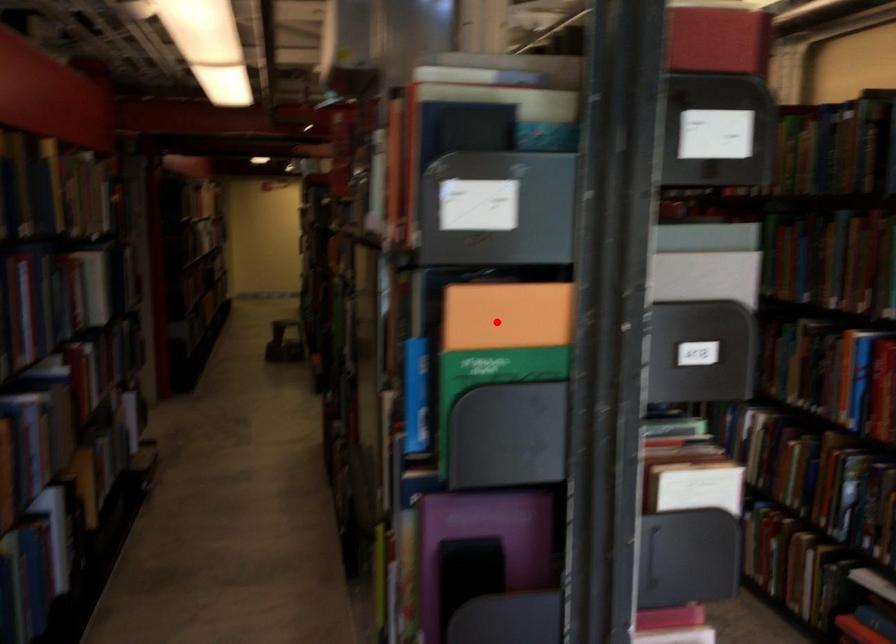
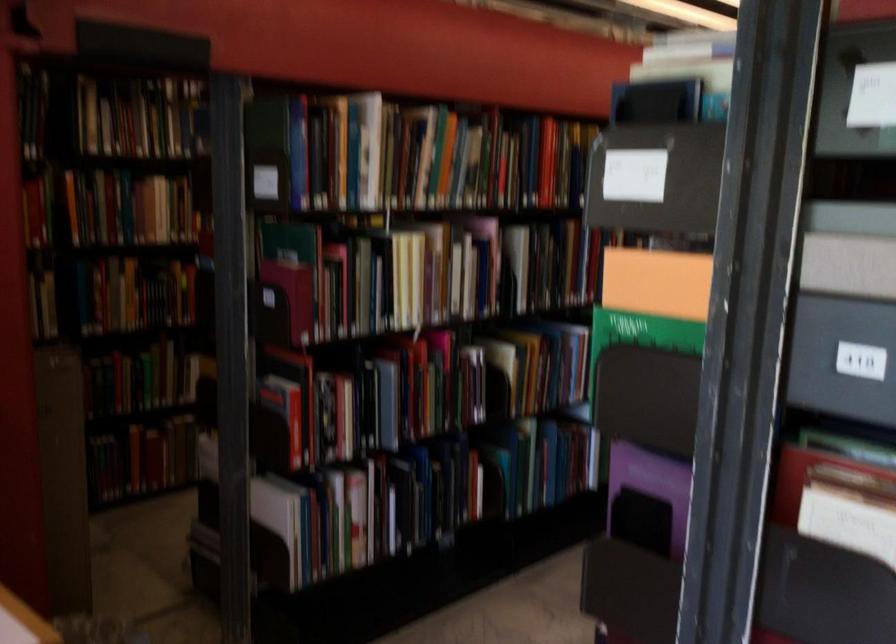
Question: I am providing you with two images of the same scene from different viewpoints. A red point is marked on the first image. Is the red point's position out of view in image 2?

Choices:
 (A) Yes
 (B) No

Answer: (B)